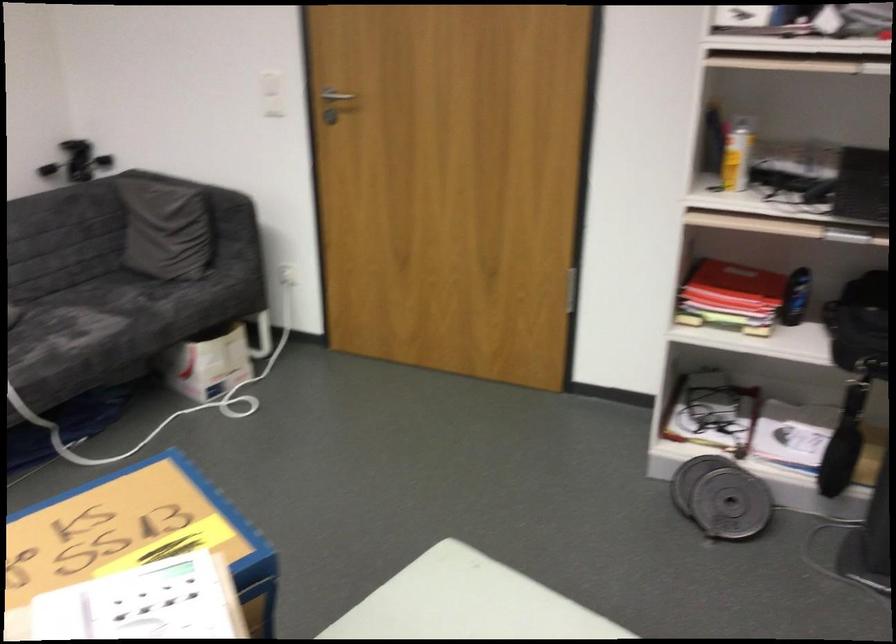
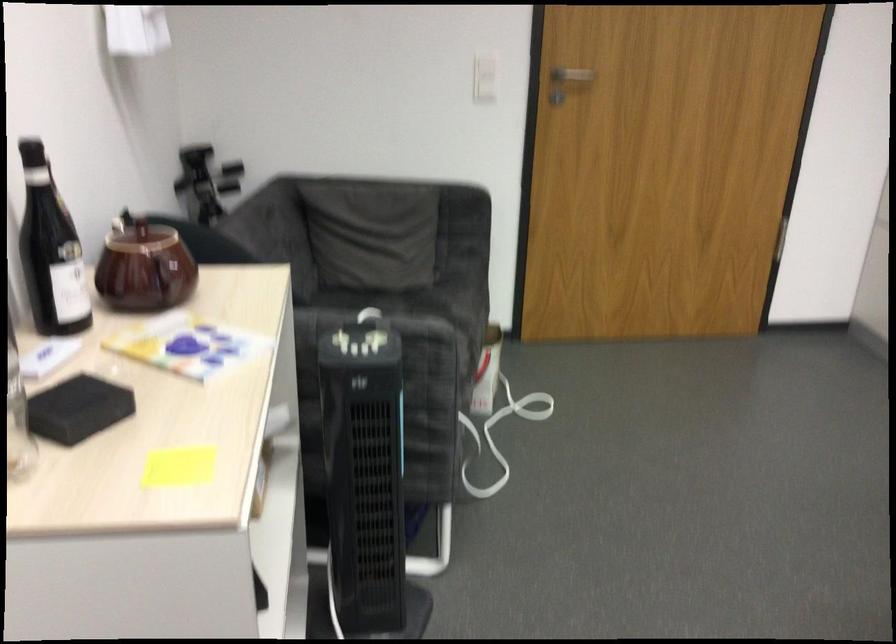
The point at (x=274, y=99) is marked in the first image. Where is the corresponding point in the second image?

(484, 77)